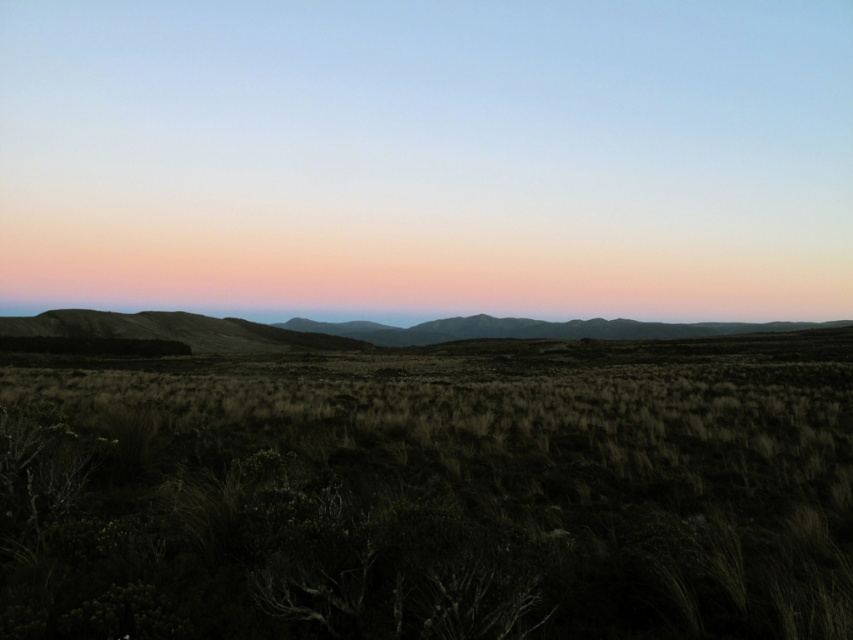
Question: Which point is farther to the camera?

Choices:
 (A) (602, 381)
 (B) (376, 196)

Answer: (B)

Question: Is smooth grassy plain at center bigger than brown rough grass at center?

Choices:
 (A) no
 (B) yes

Answer: (B)

Question: Does smooth grassy plain at center appear on the right side of brown rough grass at center?

Choices:
 (A) yes
 (B) no

Answer: (B)

Question: Which of the following is the farthest from the observer?

Choices:
 (A) smooth grassy plain at center
 (B) brown rough grass at center

Answer: (A)

Question: Is smooth grassy plain at center closer to camera compared to brown rough grass at center?

Choices:
 (A) no
 (B) yes

Answer: (A)